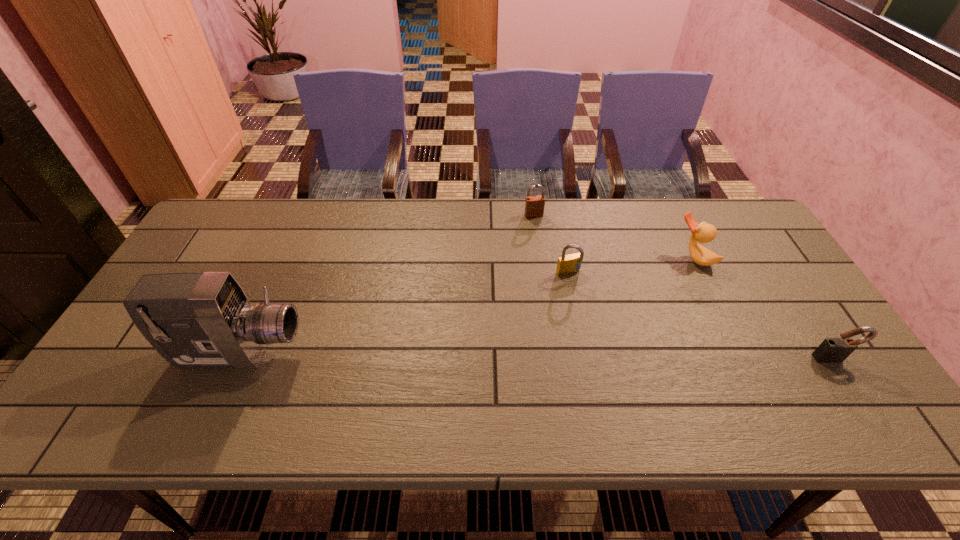
You are a GUI agent. You are given a task and a screenshot of the screen. Output one action in this format:
    pyautogui.click(x=<x>, y=<y>)
    Task: Click on the free space at the right edge of the desktop
    The width and height of the screenshot is (960, 540).
    Given the screenshot: What is the action you would take?
    pyautogui.click(x=816, y=343)

At what (x,y) coordinates should I click in order to perform the action: click on vacant space at the far left corner of the desktop. Please return your answer as a coordinate pair (x, y). Looking at the image, I should click on (229, 204).

The image size is (960, 540). I want to click on free space at the near left corner of the desktop, so click(x=162, y=383).

You are a GUI agent. You are given a task and a screenshot of the screen. Output one action in this format:
    pyautogui.click(x=<x>, y=<y>)
    Task: Click on the vacant region at the near right corner of the desktop
    This screenshot has height=540, width=960.
    Given the screenshot: What is the action you would take?
    pyautogui.click(x=815, y=369)

The height and width of the screenshot is (540, 960). Find the location of `free space between the second object from right to left and the farthest object`. free space between the second object from right to left and the farthest object is located at coordinates (613, 237).

The image size is (960, 540). Find the location of `free space between the tallest object and the rightmost object`. free space between the tallest object and the rightmost object is located at coordinates (537, 356).

At what (x,y) coordinates should I click in order to perform the action: click on free spot between the duck and the rightmost object. Please return your answer as a coordinate pair (x, y). The height and width of the screenshot is (540, 960). Looking at the image, I should click on (763, 308).

Image resolution: width=960 pixels, height=540 pixels. In order to click on free spot between the second object from left to right and the second nearest padlock in this screenshot , I will do `click(551, 244)`.

I want to click on free spot between the fourth object from left to right and the farthest padlock, so click(613, 237).

Image resolution: width=960 pixels, height=540 pixels. What are the coordinates of `vacant space that's between the farthest padlock and the tallest object` in the screenshot? It's located at (387, 285).